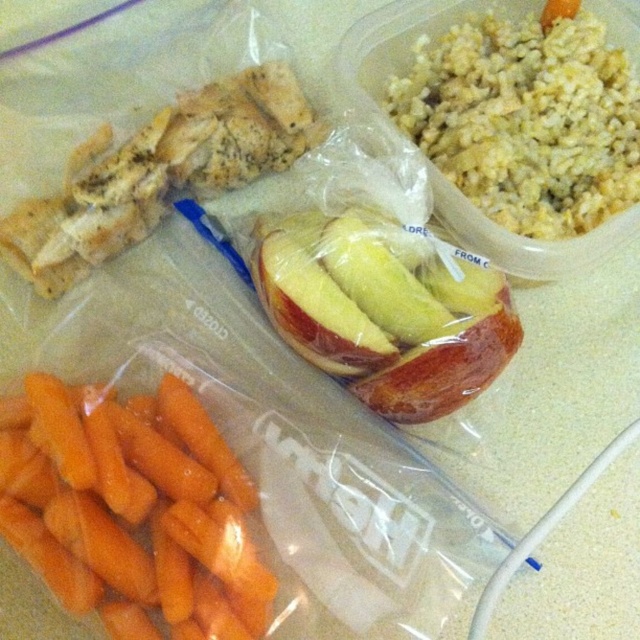
Question: Based on their relative distances, which object is farther from the red glossy apple at center?

Choices:
 (A) yellowish rice at upper right
 (B) orange smooth skin carrots at lower left

Answer: (B)

Question: Is the position of orange smooth skin carrots at lower left more distant than that of yellowish rice at upper right?

Choices:
 (A) no
 (B) yes

Answer: (A)

Question: Is orange smooth skin carrots at lower left behind red glossy apple at center?

Choices:
 (A) no
 (B) yes

Answer: (A)

Question: Is orange smooth skin carrots at lower left thinner than red glossy apple at center?

Choices:
 (A) yes
 (B) no

Answer: (A)

Question: Which point is farther from the camera taking this photo?

Choices:
 (A) (524, 179)
 (B) (349, 253)

Answer: (A)

Question: Considering the real-world distances, which object is closest to the red glossy apple at center?

Choices:
 (A) orange smooth skin carrots at lower left
 (B) yellowish rice at upper right

Answer: (B)